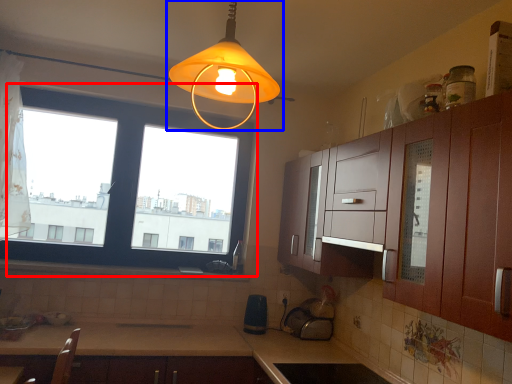
Question: Which point is closer to the camera, window (highlighted by a red box) or lamp (highlighted by a blue box)?

Choices:
 (A) window
 (B) lamp

Answer: (B)